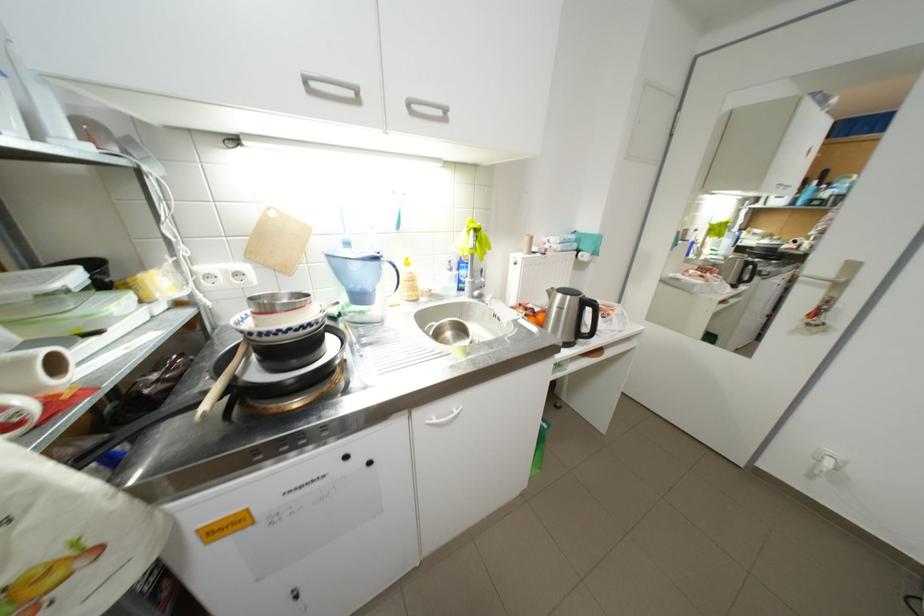
What do you see at coordinates (388, 268) in the screenshot? I see `the pitcher handle` at bounding box center [388, 268].